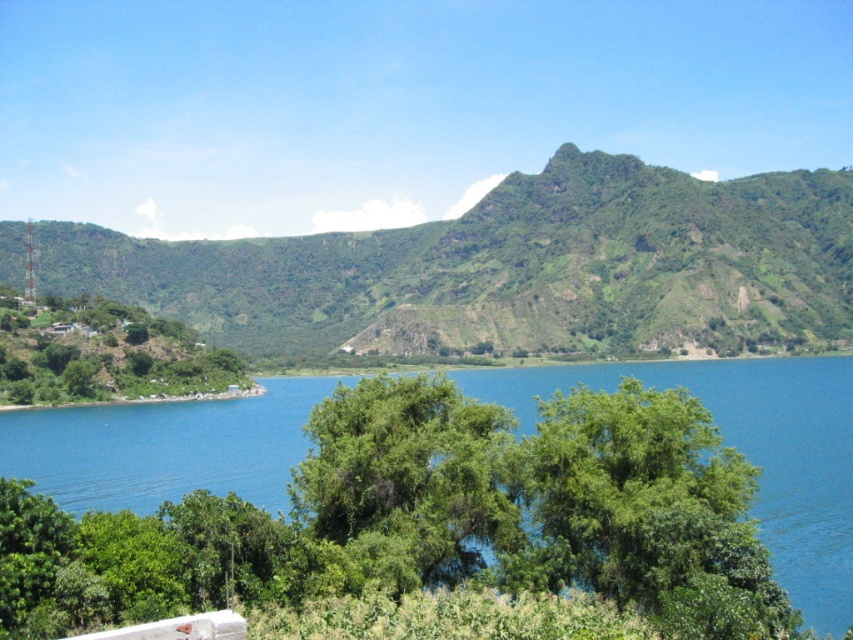
Question: Is green leafy mountain at center to the left of green leafy tree at center from the viewer's perspective?

Choices:
 (A) no
 (B) yes

Answer: (B)

Question: Estimate the real-world distances between objects in this image. Which object is farther from the green leafy mountain at center?

Choices:
 (A) green leafy tree at left
 (B) blue water at center

Answer: (A)

Question: Among these points, which one is farthest from the camera?

Choices:
 (A) (105, 352)
 (B) (387, 492)

Answer: (A)

Question: Is green leafy tree at center below green leafy tree at left?

Choices:
 (A) yes
 (B) no

Answer: (A)

Question: Is green leafy mountain at center above blue water at center?

Choices:
 (A) yes
 (B) no

Answer: (A)

Question: Among these points, which one is nearest to the camera?

Choices:
 (A) (457, 531)
 (B) (715, 380)
 (C) (636, 276)
 (D) (51, 307)

Answer: (A)